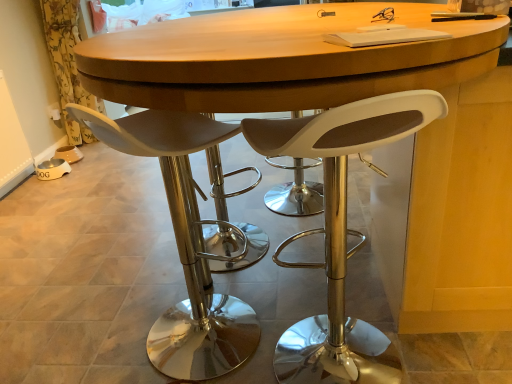
At what (x,y) coordinates should I click in order to perform the action: click on vacant area that lies to the right of white matte stool at center, arranged as the first chair when viewed from the left. Please return your answer as a coordinate pair (x, y). This screenshot has height=384, width=512. Looking at the image, I should click on (276, 308).